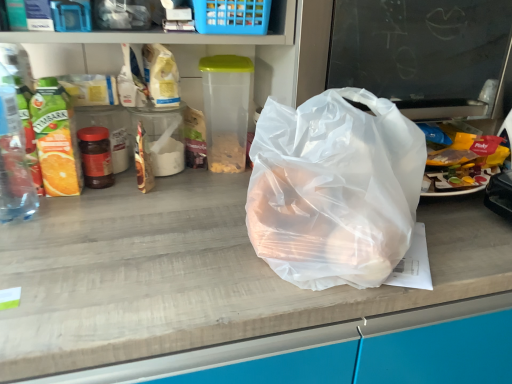
Question: Should I look upward or downward to see transparent plastic bag at center?

Choices:
 (A) down
 (B) up

Answer: (B)

Question: Is clear plastic bottle at left not within transparent plastic bag at center?

Choices:
 (A) yes
 (B) no

Answer: (A)

Question: Does clear plastic bottle at left contain transparent plastic bag at center?

Choices:
 (A) no
 (B) yes

Answer: (A)

Question: Are clear plastic bottle at left and transparent plastic bag at center located far from each other?

Choices:
 (A) no
 (B) yes

Answer: (A)

Question: Is clear plastic bottle at left thinner than transparent plastic bag at center?

Choices:
 (A) no
 (B) yes

Answer: (B)

Question: From the image's perspective, is clear plastic bottle at left under transparent plastic bag at center?

Choices:
 (A) no
 (B) yes

Answer: (B)

Question: Is clear plastic bottle at left positioned with its back to transparent plastic bag at center?

Choices:
 (A) no
 (B) yes

Answer: (A)

Question: Is clear plastic bottle at left positioned in front of transparent plastic bag at center?

Choices:
 (A) no
 (B) yes

Answer: (A)

Question: Considering the relative sizes of clear plastic bottle at left and transparent plastic bag at center in the image provided, is clear plastic bottle at left bigger than transparent plastic bag at center?

Choices:
 (A) yes
 (B) no

Answer: (B)

Question: Considering the relative sizes of clear plastic bottle at left and transparent plastic bag at center in the image provided, is clear plastic bottle at left shorter than transparent plastic bag at center?

Choices:
 (A) no
 (B) yes

Answer: (A)

Question: From a real-world perspective, is clear plastic bottle at left located higher than transparent plastic bag at center?

Choices:
 (A) no
 (B) yes

Answer: (B)

Question: Is clear plastic bottle at left smaller than transparent plastic bag at center?

Choices:
 (A) yes
 (B) no

Answer: (A)

Question: Considering the relative sizes of clear plastic bottle at left and transparent plastic bag at center in the image provided, is clear plastic bottle at left wider than transparent plastic bag at center?

Choices:
 (A) no
 (B) yes

Answer: (A)

Question: Does transparent plastic bag at center come in front of transparent plastic bag at center?

Choices:
 (A) no
 (B) yes

Answer: (B)